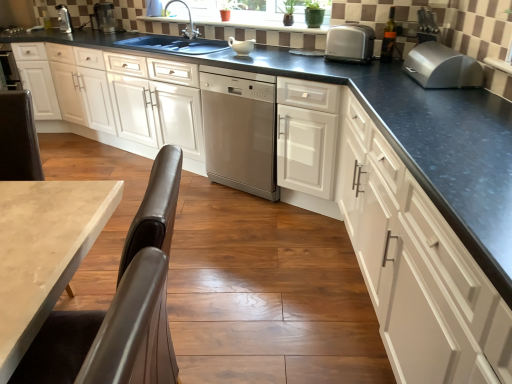
Question: Does stainless steel dishwasher at center have a greater width compared to satin silver toaster at upper right, positioned as the 2th kitchen appliance in bottom-to-top order?

Choices:
 (A) no
 (B) yes

Answer: (B)

Question: Is stainless steel dishwasher at center thinner than satin silver toaster at upper right, the first kitchen appliance when ordered from top to bottom?

Choices:
 (A) yes
 (B) no

Answer: (B)

Question: From a real-world perspective, is stainless steel dishwasher at center located beneath satin silver toaster at upper right, the first kitchen appliance when ordered from top to bottom?

Choices:
 (A) no
 (B) yes

Answer: (B)

Question: Does stainless steel dishwasher at center have a larger size compared to satin silver toaster at upper right, the second kitchen appliance from the front?

Choices:
 (A) no
 (B) yes

Answer: (B)

Question: From a real-world perspective, is stainless steel dishwasher at center over satin silver toaster at upper right, the first kitchen appliance from the back?

Choices:
 (A) no
 (B) yes

Answer: (A)

Question: From a real-world perspective, is white glossy cabinet at center, arranged as the 2th cabinetry when viewed from the left, above or below white glossy cabinet at center, which is counted as the 3th cabinetry, starting from the right?

Choices:
 (A) below
 (B) above

Answer: (A)

Question: Is white glossy cabinet at center, acting as the second cabinetry starting from the right, to the left or to the right of white glossy cabinet at center, arranged as the 1th cabinetry when viewed from the left, in the image?

Choices:
 (A) right
 (B) left

Answer: (A)

Question: From the image's perspective, is white glossy cabinet at center, acting as the second cabinetry starting from the right, positioned above or below white glossy cabinet at center, arranged as the 1th cabinetry when viewed from the left?

Choices:
 (A) below
 (B) above

Answer: (A)

Question: Is point (322, 97) positioned closer to the camera than point (77, 99)?

Choices:
 (A) farther
 (B) closer

Answer: (B)

Question: Looking at their shapes, would you say silver metallic breadbox at upper right, positioned as the 2th kitchen appliance in back-to-front order, is wider or thinner than stainless steel dishwasher at center?

Choices:
 (A) thin
 (B) wide

Answer: (A)

Question: In the image, is silver metallic breadbox at upper right, marked as the 2th kitchen appliance in a left-to-right arrangement, positioned in front of or behind stainless steel dishwasher at center?

Choices:
 (A) behind
 (B) front

Answer: (B)

Question: Considering the positions of silver metallic breadbox at upper right, which ranks as the first kitchen appliance in right-to-left order, and stainless steel dishwasher at center in the image, is silver metallic breadbox at upper right, which ranks as the first kitchen appliance in right-to-left order, taller or shorter than stainless steel dishwasher at center?

Choices:
 (A) short
 (B) tall

Answer: (A)

Question: From the image's perspective, is silver metallic breadbox at upper right, the 2th kitchen appliance positioned from the top, located above or below stainless steel dishwasher at center?

Choices:
 (A) below
 (B) above

Answer: (B)

Question: Considering their positions, is green matte plant at upper center located in front of or behind silver metallic breadbox at upper right, the first kitchen appliance viewed from the front?

Choices:
 (A) behind
 (B) front

Answer: (A)

Question: Which is correct: green matte plant at upper center is inside silver metallic breadbox at upper right, placed as the 1th kitchen appliance when sorted from bottom to top, or outside of it?

Choices:
 (A) inside
 (B) outside

Answer: (B)